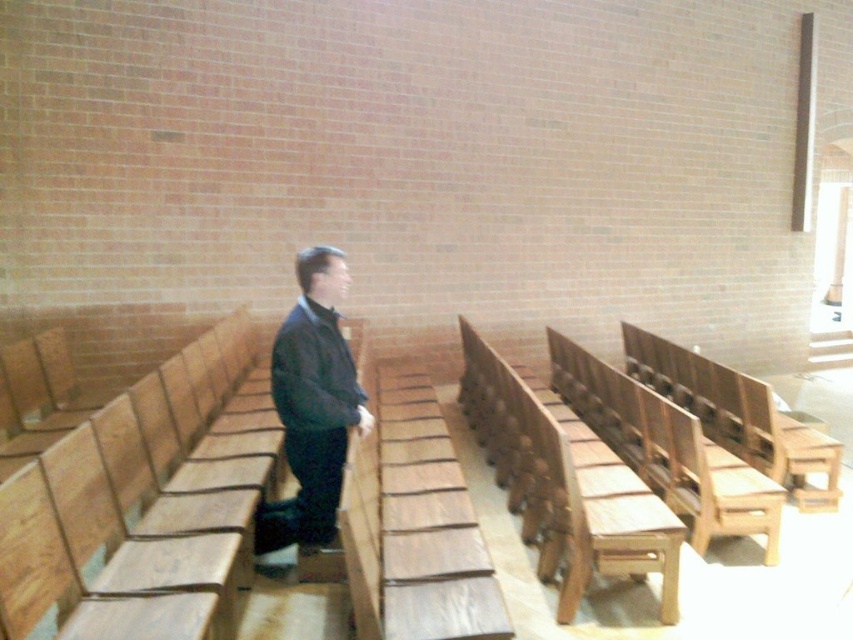
Question: Can you confirm if wooden bench at center is positioned to the left of dark blue jacket at center?

Choices:
 (A) yes
 (B) no

Answer: (B)

Question: Does wooden bench at center have a smaller size compared to dark blue jacket at center?

Choices:
 (A) no
 (B) yes

Answer: (A)

Question: Does wooden bench at center have a smaller size compared to dark blue jacket at center?

Choices:
 (A) yes
 (B) no

Answer: (B)